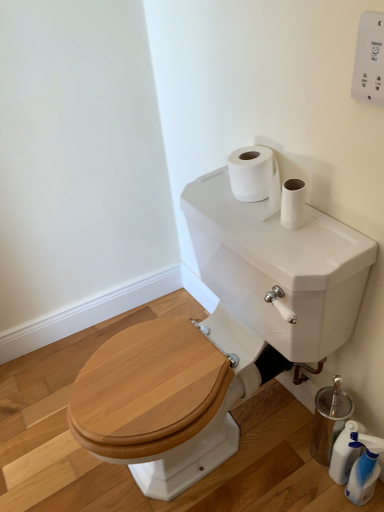
Where is `vacant space that is to the left of white glossy tank at upper center`? vacant space that is to the left of white glossy tank at upper center is located at coordinates (45, 426).